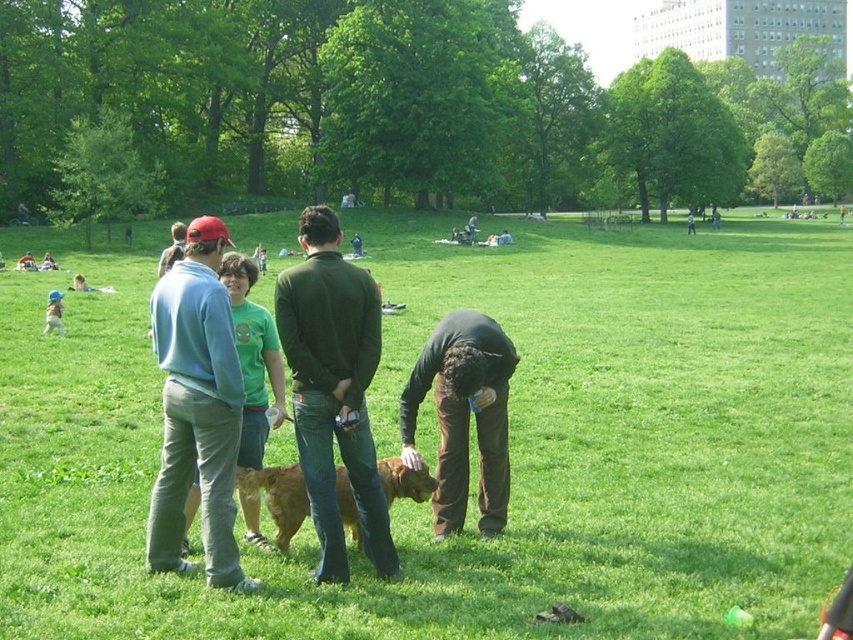
In the scene shown: You are a photographer trying to capture a closeup of the golden brown fur at center without getting the brown cotton pants at center in the frame. Can you do this based on their widths?

The brown cotton pants at center might be wider than golden brown fur at center, so there is a possibility that the pants could block the fur if they are wider. You might need to adjust your angle or position to ensure the fur is visible without the pants obstructing it.

You are standing in the park and see two people wearing the green matte shirt at center and the light blue sweatshirt at left. Which one is positioned more to the left side of the park?

The light blue sweatshirt at left is positioned more to the left side of the park because the green matte shirt at center is to the right of it.